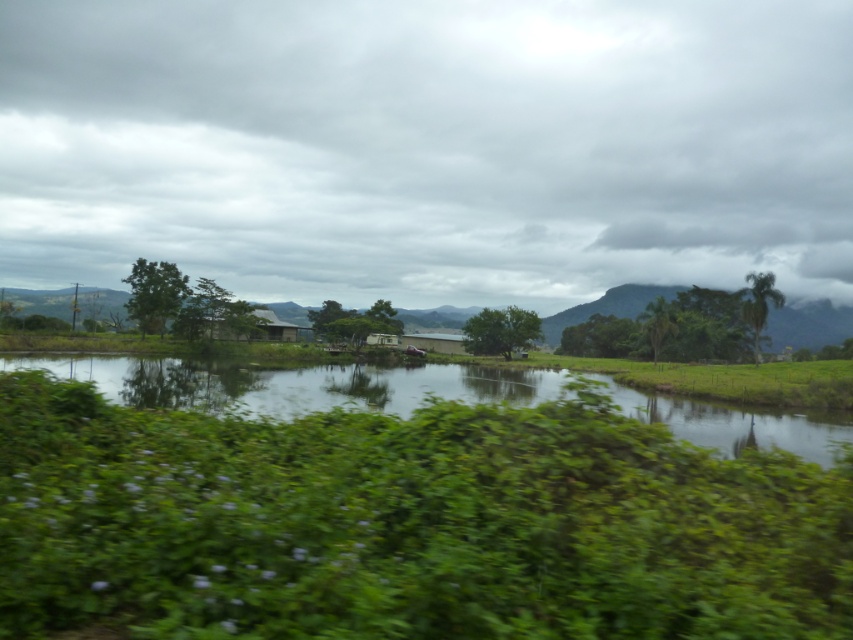
Question: Can you confirm if green reflective water at center is positioned to the left of green leafy tree at center?

Choices:
 (A) yes
 (B) no

Answer: (A)

Question: Which of the following is the closest to the observer?

Choices:
 (A) green reflective water at center
 (B) green leafy tree at center

Answer: (A)

Question: Is green leafy bush at center above green leafy tree at center?

Choices:
 (A) no
 (B) yes

Answer: (B)

Question: Which point is farther to the camera?

Choices:
 (A) (338, 364)
 (B) (262, 524)
 (C) (494, 310)

Answer: (C)

Question: Which point is farther to the camera?

Choices:
 (A) green reflective water at center
 (B) green leafy tree at center
 (C) green leafy bush at center

Answer: (B)

Question: Can you confirm if green reflective water at center is positioned to the right of green leafy tree at center?

Choices:
 (A) yes
 (B) no

Answer: (B)